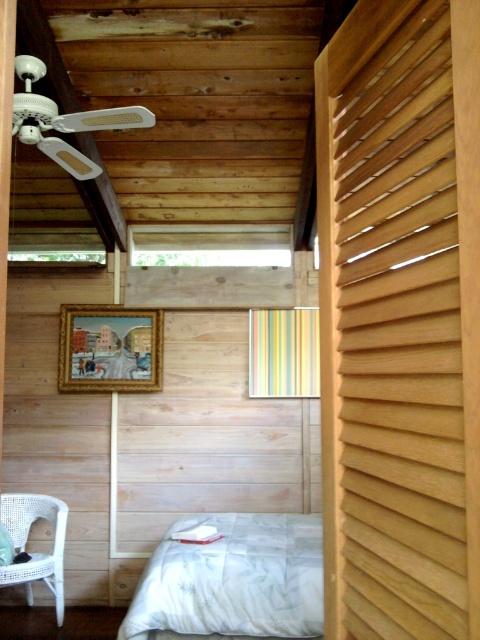
I want to click on white soft bed at lower center, so click(233, 580).

Between white soft bed at lower center and white wicker chair at lower left, which one has less height?

Standing shorter between the two is white soft bed at lower center.

Identify the location of white soft bed at lower center. (233, 580).

The width and height of the screenshot is (480, 640). What are the coordinates of `white soft bed at lower center` in the screenshot? It's located at (233, 580).

In order to click on white wicker chair at lower left in this screenshot , I will do `click(25, 541)`.

Does white wicker chair at lower left appear on the right side of white soft pillow at lower center?

Correct, you'll find white wicker chair at lower left to the right of white soft pillow at lower center.

Does point (31, 588) lie behind point (8, 536)?

Yes, point (31, 588) is farther from viewer.

Locate an element on the screen. This screenshot has height=640, width=480. white wicker chair at lower left is located at coordinates (25, 541).

Does light brown wooden slats at right appear under white soft pillow at lower center?

Incorrect, light brown wooden slats at right is not positioned below white soft pillow at lower center.

Between point (381, 420) and point (6, 561), which one is positioned behind?

The point (6, 561) is more distant.

This screenshot has width=480, height=640. Find the location of `light brown wooden slats at right`. light brown wooden slats at right is located at coordinates (399, 320).